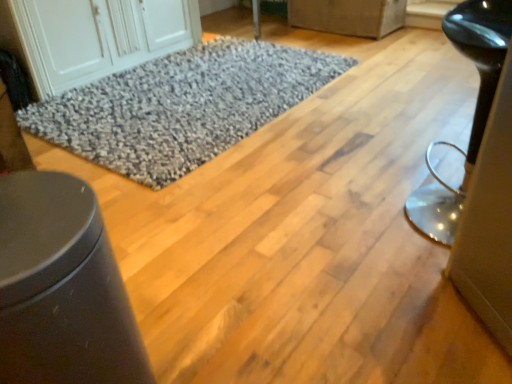
Question: From a real-world perspective, relative to white wood cabinet at upper left, is matte gray fabric couch at upper center, the first furniture viewed from the top, vertically above or below?

Choices:
 (A) below
 (B) above

Answer: (A)

Question: In terms of width, does matte gray fabric couch at upper center, marked as the 1th furniture in a right-to-left arrangement, look wider or thinner when compared to white wood cabinet at upper left?

Choices:
 (A) thin
 (B) wide

Answer: (A)

Question: Which object is the closest to the gray shaggy rug at center?

Choices:
 (A) white wood cabinet at upper left
 (B) glossy black stool at right, the 2th furniture from the bottom
 (C) matte gray fabric couch at upper center, the first furniture from the back
 (D) matte black trash can at lower left, the third furniture from the right

Answer: (A)

Question: Which is nearer to the glossy black stool at right, which appears as the 2th furniture when viewed from the back?

Choices:
 (A) white wood cabinet at upper left
 (B) gray shaggy rug at center
 (C) matte gray fabric couch at upper center, the first furniture from the back
 (D) matte black trash can at lower left, placed as the 1th furniture when sorted from left to right

Answer: (D)